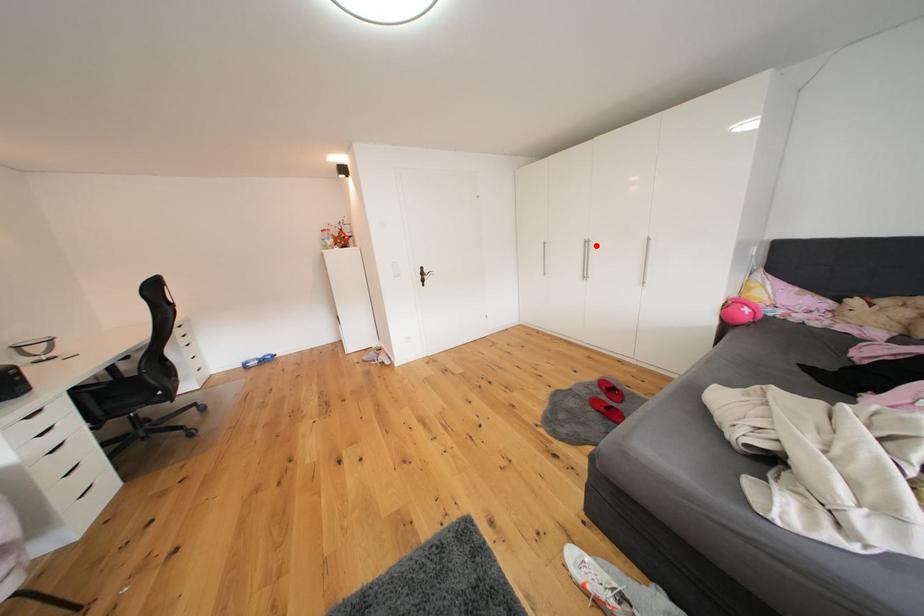
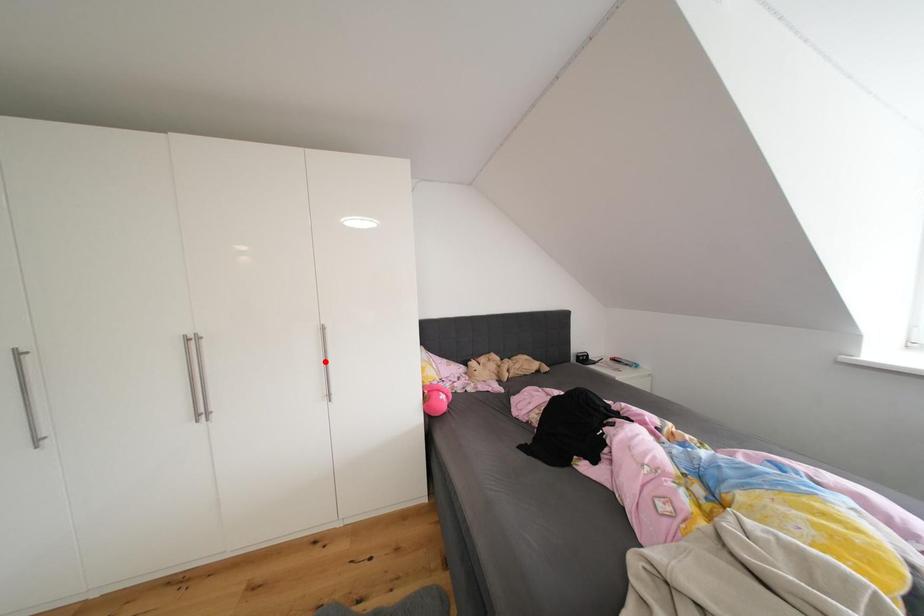
I am providing you with two images of the same scene from different viewpoints. A red point is marked on the first image and another point is marked on the second image. Do the highlighted points in image1 and image2 indicate the same real-world spot?

No